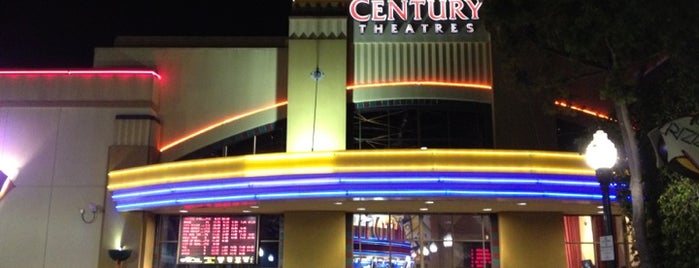
Locate an element on the screen. This screenshot has width=699, height=268. glass window is located at coordinates [x=463, y=223].